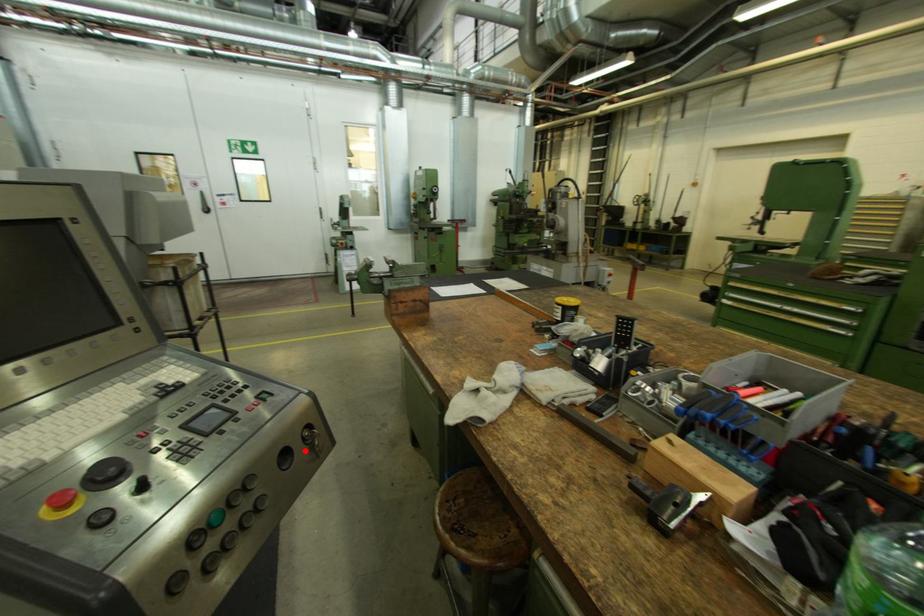
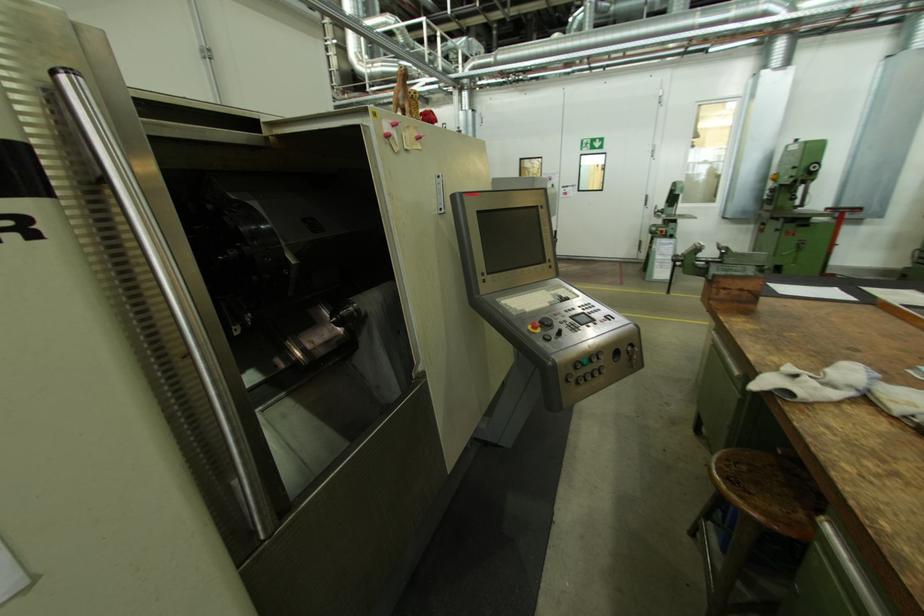
The point at the highlighted location is marked in the first image. Where is the corresponding point in the second image?

(629, 357)